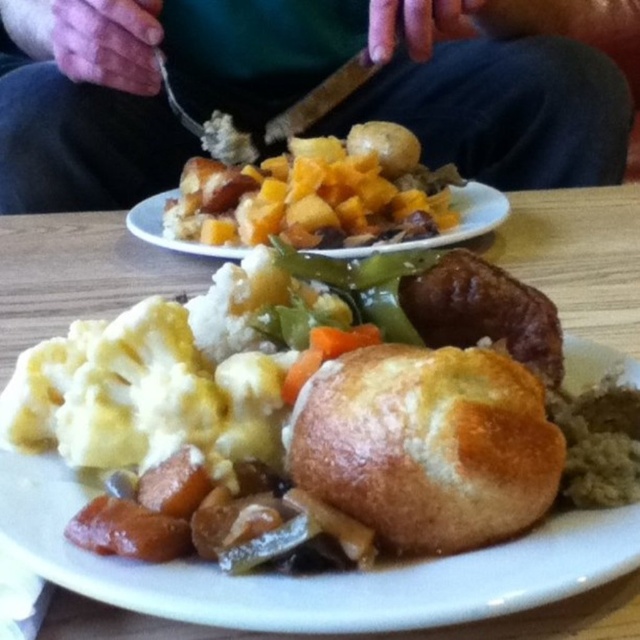
You are a chef preparing to place a 10 cm wide gravy boat on the table. The golden brown crusty bread at center is located at coordinate point 0.669. Is there enough space to place the gravy boat without overlapping the bread?

The golden brown crusty bread at center is located at point 0.669. Since the gravy boat is 10 cm wide, there should be enough space to place it without overlapping the bread as long as it is positioned appropriately on the table.

You are a food critic sitting at the table. You want to taste both the golden brown crusty bread at center and the golden brown crumbly pastry at center. Which one is closer to your hand if your hand is placed at the edge of the table?

The golden brown crusty bread at center is closer to your hand because it is located below the golden brown crumbly pastry at center, meaning it is positioned lower on the table and thus nearer to the edge where your hand is placed.